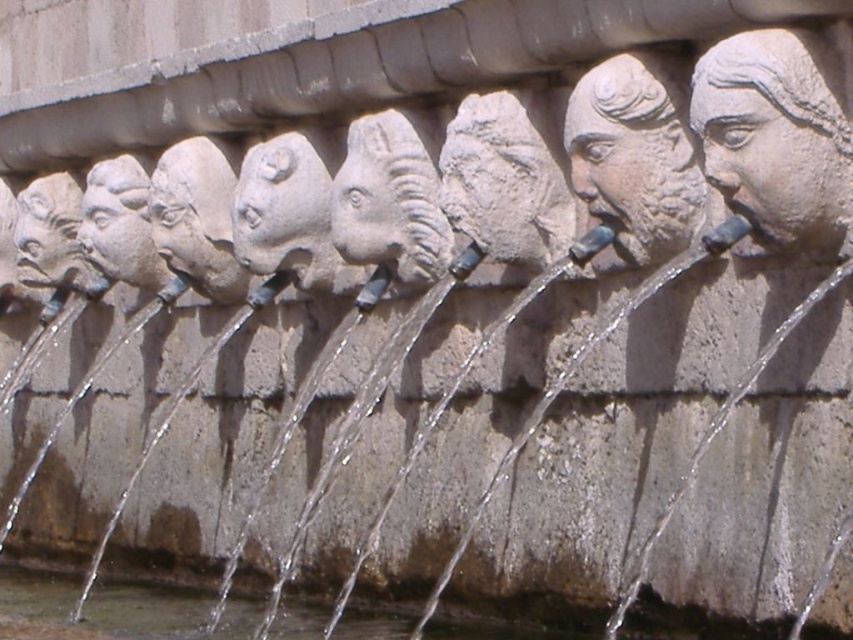
Question: Observing the image, what is the correct spatial positioning of matte stone head at center in reference to matte stone face at center?

Choices:
 (A) below
 (B) above

Answer: (A)

Question: Among these objects, which one is nearest to the camera?

Choices:
 (A) matte stone head at center
 (B) matte stone face at left
 (C) gray stone face at right

Answer: (C)

Question: Does matte stone head at center have a greater width compared to matte stone face at left?

Choices:
 (A) no
 (B) yes

Answer: (A)

Question: Which point is farther to the camera?

Choices:
 (A) gray stone face at center
 (B) stone textured face at center

Answer: (A)

Question: Can you confirm if matte stone horse head at center is thinner than matte stone face at left?

Choices:
 (A) yes
 (B) no

Answer: (B)

Question: Which point is farther from the camera taking this photo?

Choices:
 (A) (114, 628)
 (B) (781, 248)

Answer: (A)